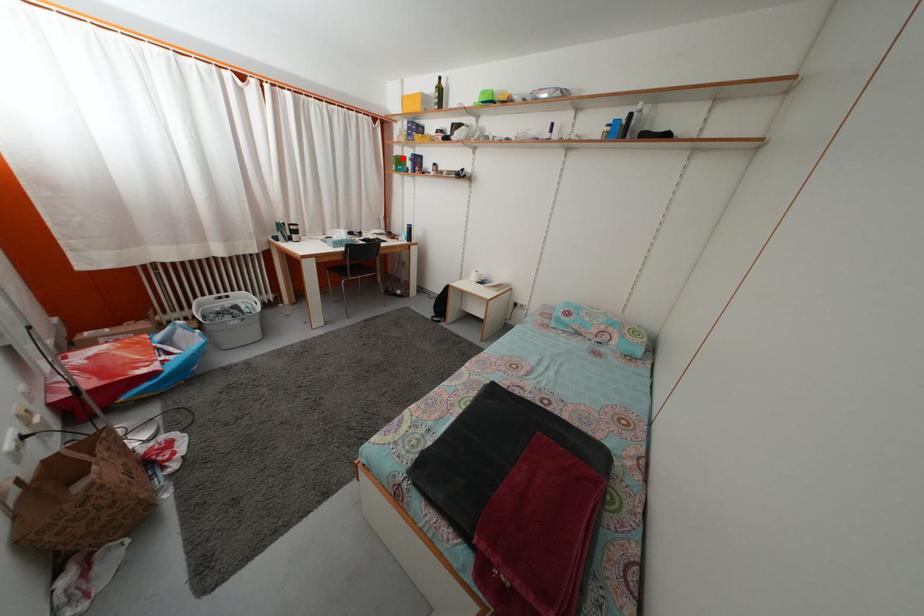
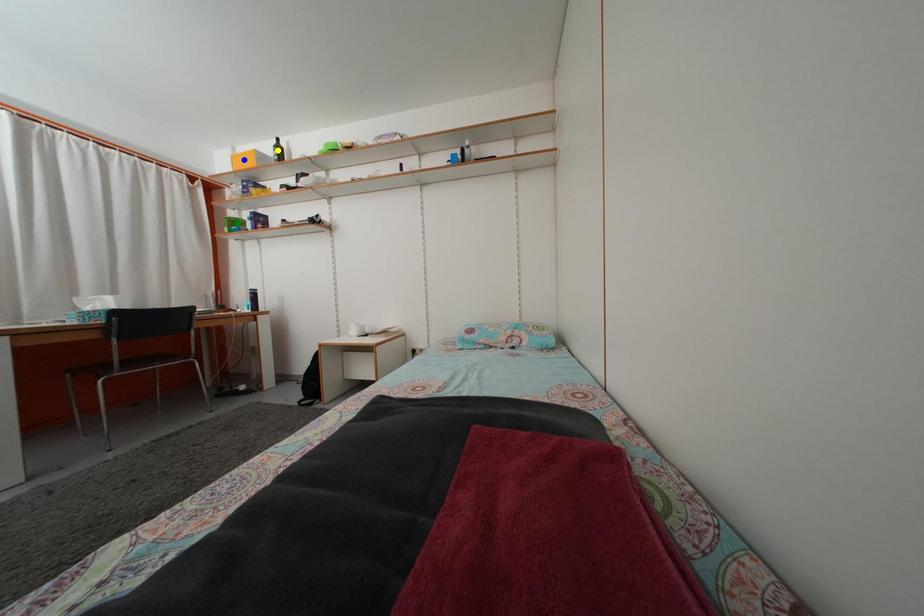
Question: I am providing you with two images of the same scene from different viewpoints. A red point is marked on the first image. You are given multiple points on the second image. In image 2, which mark is for the same physical point as the one in image 1?

Choices:
 (A) green point
 (B) yellow point
 (C) blue point

Answer: (A)